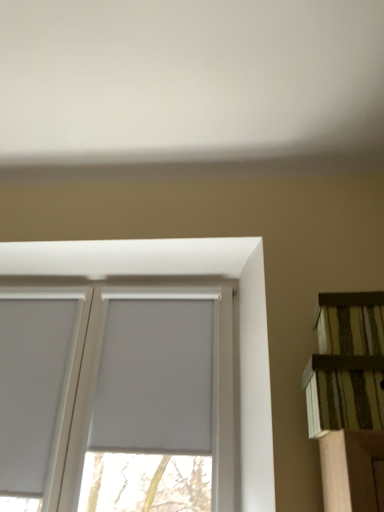
Question: Can you confirm if white matte window screen at center is smaller than striped fabric shelf at right?

Choices:
 (A) yes
 (B) no

Answer: (B)

Question: Is white matte window screen at center with striped fabric shelf at right?

Choices:
 (A) no
 (B) yes

Answer: (A)

Question: Would you say white matte window screen at center contains striped fabric shelf at right?

Choices:
 (A) yes
 (B) no

Answer: (B)

Question: From a real-world perspective, is white matte window screen at center physically above striped fabric shelf at right?

Choices:
 (A) no
 (B) yes

Answer: (B)

Question: From a real-world perspective, does white matte window screen at center sit lower than striped fabric shelf at right?

Choices:
 (A) yes
 (B) no

Answer: (B)

Question: Considering the relative sizes of white matte window screen at center and striped fabric shelf at right in the image provided, is white matte window screen at center shorter than striped fabric shelf at right?

Choices:
 (A) yes
 (B) no

Answer: (B)

Question: Is the depth of striped fabric shelf at right less than that of white matte window at center?

Choices:
 (A) yes
 (B) no

Answer: (A)

Question: Is striped fabric shelf at right facing towards white matte window at center?

Choices:
 (A) yes
 (B) no

Answer: (B)

Question: Is striped fabric shelf at right located outside white matte window at center?

Choices:
 (A) yes
 (B) no

Answer: (A)

Question: Does striped fabric shelf at right touch white matte window at center?

Choices:
 (A) no
 (B) yes

Answer: (A)

Question: Is white matte window at center at the back of striped fabric shelf at right?

Choices:
 (A) no
 (B) yes

Answer: (A)

Question: Considering the relative positions of striped fabric shelf at right and white matte window at center in the image provided, is striped fabric shelf at right to the left of white matte window at center from the viewer's perspective?

Choices:
 (A) yes
 (B) no

Answer: (B)

Question: Is white matte window screen at center not within white matte window at center?

Choices:
 (A) no
 (B) yes

Answer: (A)